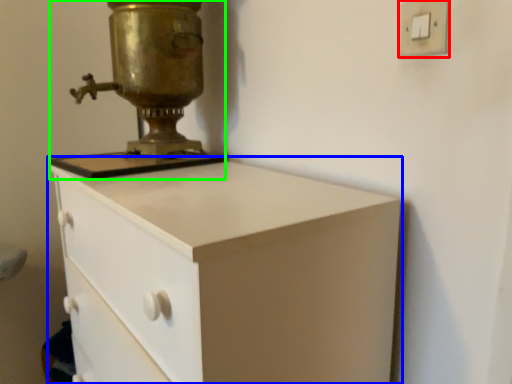
Question: Estimate the real-world distances between objects in this image. Which object is closer to light switch (highlighted by a red box), chest of drawers (highlighted by a blue box) or sewing machine (highlighted by a green box)?

Choices:
 (A) chest of drawers
 (B) sewing machine

Answer: (A)